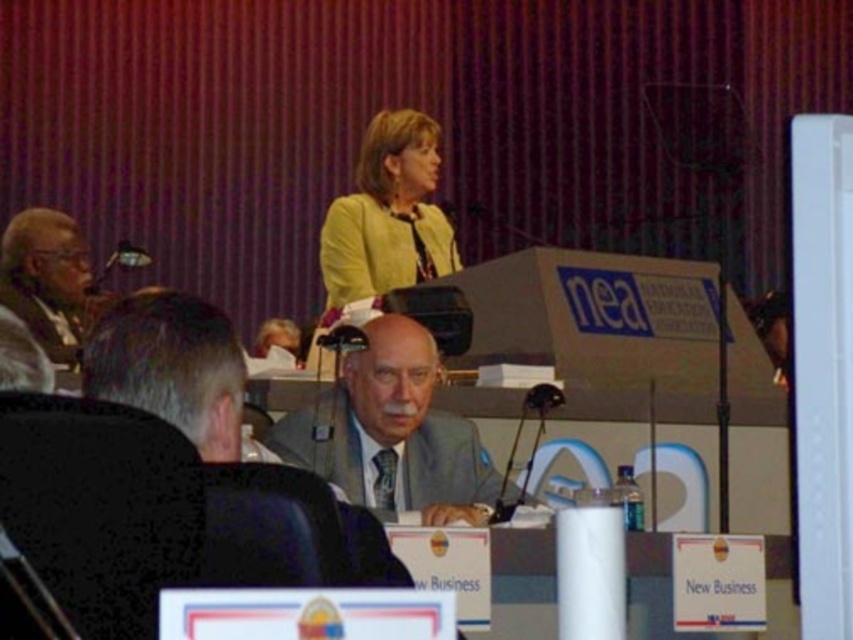
Is point (318, 456) farther from camera compared to point (379, 225)?

That is False.

Can you confirm if gray suit at center is positioned above matte yellow jacket at center?

Incorrect, gray suit at center is not positioned above matte yellow jacket at center.

Is point (431, 512) less distant than point (431, 234)?

Yes.

The image size is (853, 640). I want to click on gray suit at center, so click(x=393, y=435).

Can you confirm if gray suit at center is wider than matte black microphone at left?

Correct, the width of gray suit at center exceeds that of matte black microphone at left.

Does gray suit at center have a lesser width compared to matte black microphone at left?

In fact, gray suit at center might be wider than matte black microphone at left.

Describe the element at coordinates (393, 435) in the screenshot. This screenshot has height=640, width=853. I see `gray suit at center` at that location.

The height and width of the screenshot is (640, 853). Identify the location of gray suit at center. (393, 435).

Is matte yellow jacket at center bigger than matte black microphone at left?

Yes.

Does matte yellow jacket at center appear over matte black microphone at left?

Yes.

Locate an element on the screen. matte yellow jacket at center is located at coordinates point(387,214).